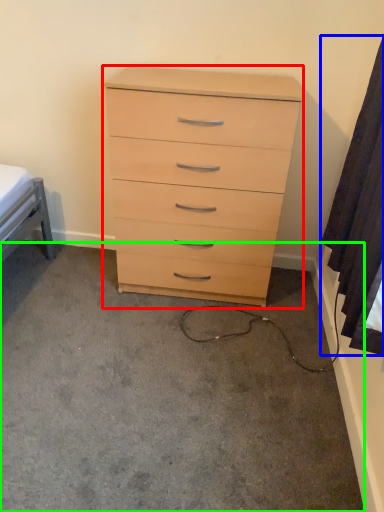
Question: Which object is the closest to the chest of drawers (highlighted by a red box)? Choose among these: curtain (highlighted by a blue box) or concrete (highlighted by a green box).

Choices:
 (A) curtain
 (B) concrete

Answer: (A)